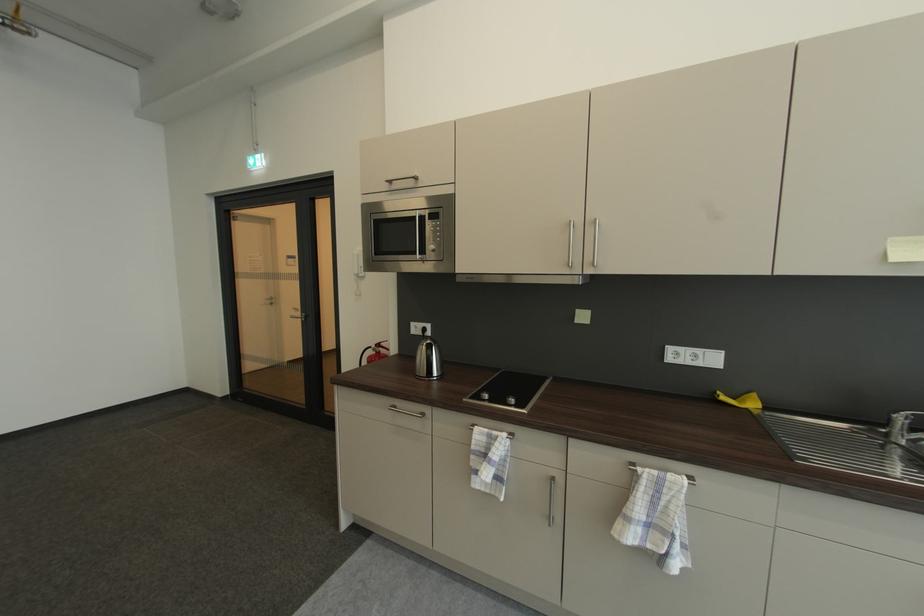
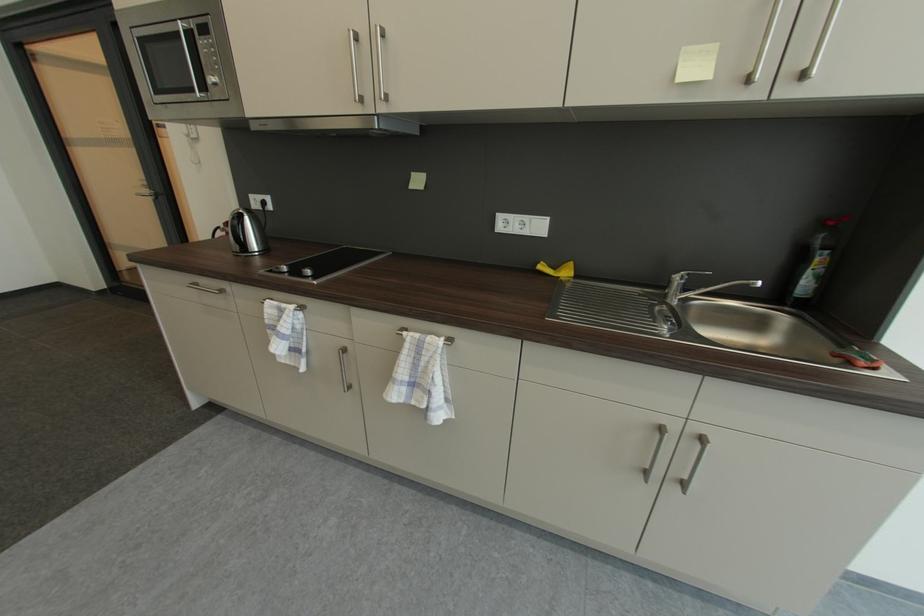
Question: How did the camera likely rotate?

Choices:
 (A) Left
 (B) Right
 (C) Up
 (D) Down

Answer: (D)